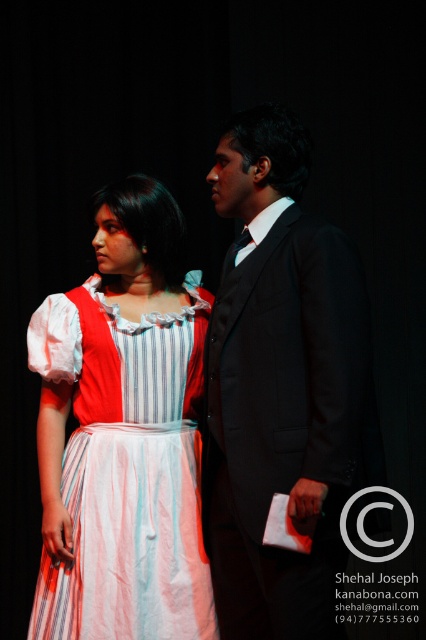
Question: Can you confirm if black satin suit at center is positioned to the left of striped cotton dress at center?

Choices:
 (A) no
 (B) yes

Answer: (A)

Question: Does black satin suit at center appear under striped cotton dress at center?

Choices:
 (A) yes
 (B) no

Answer: (B)

Question: Among these points, which one is nearest to the camera?

Choices:
 (A) (229, 320)
 (B) (144, 481)

Answer: (A)

Question: Is black satin suit at center further to camera compared to striped cotton dress at center?

Choices:
 (A) no
 (B) yes

Answer: (A)

Question: Which point appears farthest from the camera in this image?

Choices:
 (A) (294, 381)
 (B) (57, 330)

Answer: (B)